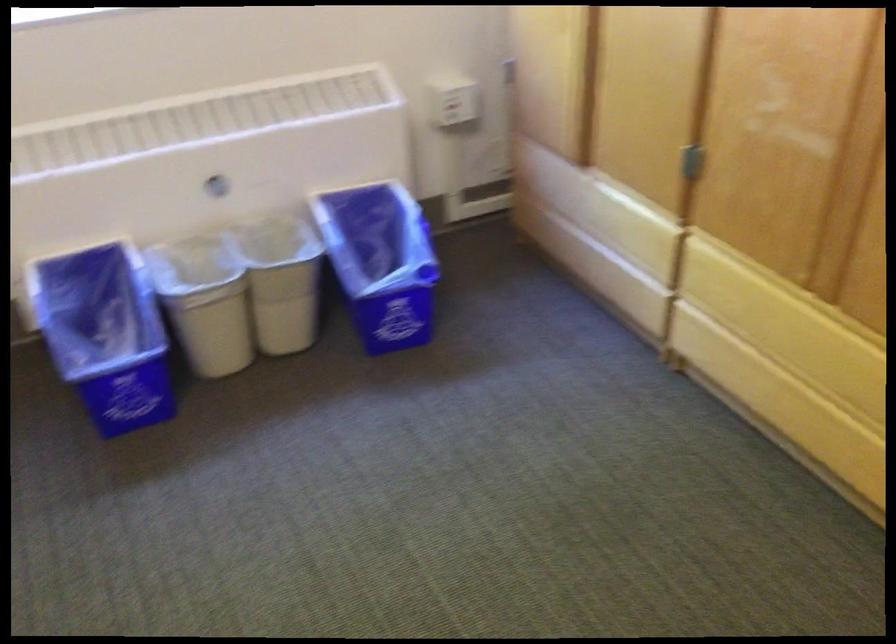
Where is `cabinet latch`? cabinet latch is located at coordinates (691, 162).